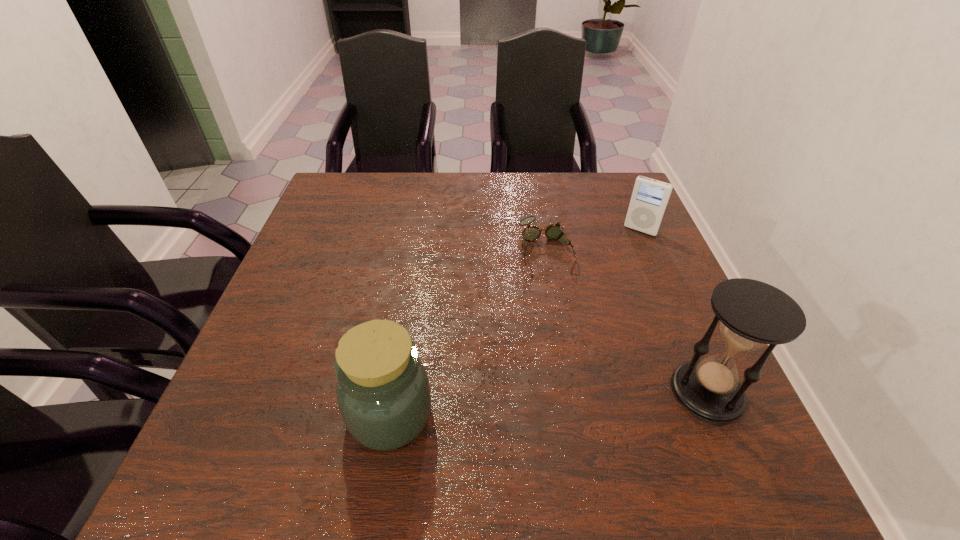
Locate an element on the screen. free space at the near edge of the desktop is located at coordinates (442, 427).

Find the location of a particular element. This screenshot has height=540, width=960. free space at the left edge of the desktop is located at coordinates (345, 264).

Find the location of a particular element. vacant area at the right edge is located at coordinates (x=635, y=333).

Where is `free spot at the far left corner of the desktop`? This screenshot has height=540, width=960. free spot at the far left corner of the desktop is located at coordinates (328, 202).

Locate an element on the screen. vacant area that lies between the third tallest object and the tallest object is located at coordinates click(x=674, y=311).

Find the location of a particular element. The width and height of the screenshot is (960, 540). free space between the spectacles and the second shortest object is located at coordinates (593, 240).

This screenshot has height=540, width=960. In order to click on empty space between the shortest object and the third tallest object in this screenshot , I will do `click(593, 240)`.

Where is `empty space between the hourglass and the shortest object`? The height and width of the screenshot is (540, 960). empty space between the hourglass and the shortest object is located at coordinates coord(627,321).

In order to click on free spot between the hourglass and the leftmost object in this screenshot , I will do `click(549, 403)`.

Identify the location of free space between the third tallest object and the spectacles. (593, 240).